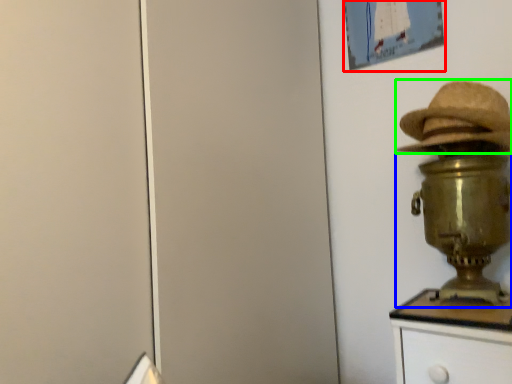
Question: Which is nearer to the picture frame (highlighted by a red box)? table lamp (highlighted by a blue box) or hat (highlighted by a green box).

Choices:
 (A) table lamp
 (B) hat

Answer: (B)